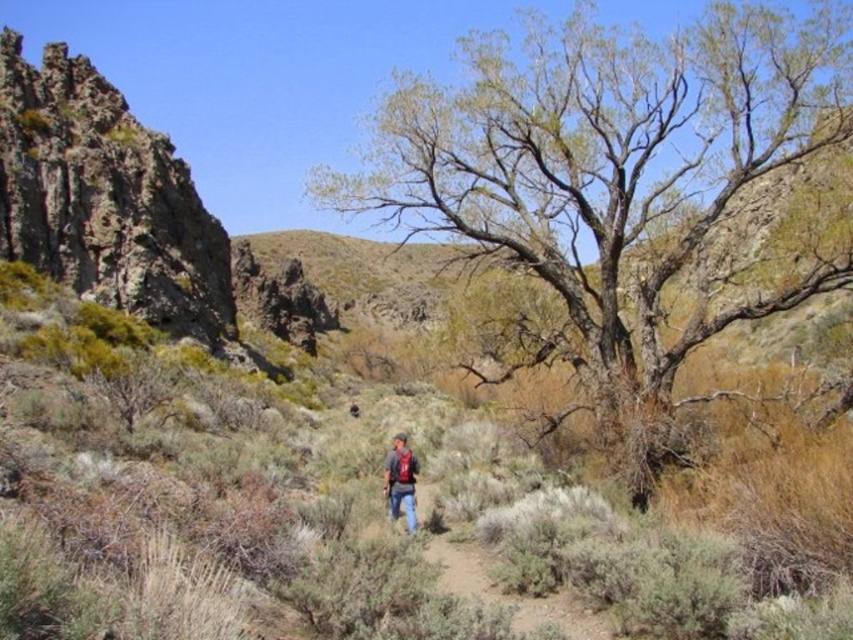
Is brown dry grass at center to the left of green rough bark tree at center from the viewer's perspective?

Correct, you'll find brown dry grass at center to the left of green rough bark tree at center.

Who is more distant from viewer, [627,602] or [497,160]?

Point [497,160]

You are a GUI agent. You are given a task and a screenshot of the screen. Output one action in this format:
    pyautogui.click(x=<x>, y=<y>)
    Task: Click on the brown dry grass at center
    Image resolution: width=853 pixels, height=640 pixels.
    Given the screenshot: What is the action you would take?
    pyautogui.click(x=352, y=506)

Is brown dry grass at center shorter than rugged stone cliff at left?

Yes.

Who is higher up, brown dry grass at center or rugged stone cliff at left?

rugged stone cliff at left is above.

Is point (212, 449) positioned before point (144, 268)?

Yes, point (212, 449) is closer to viewer.

Where is `brown dry grass at center`? The height and width of the screenshot is (640, 853). brown dry grass at center is located at coordinates (352, 506).

Between point (172, 170) and point (465, 556), which one is positioned behind?

Point (172, 170)

Does rugged stone cliff at left come behind brown dirt path at center?

A: Yes, rugged stone cliff at left is further from the viewer.

Between point (113, 216) and point (532, 627), which one is positioned behind?

The point (113, 216) is behind.

Where is `rugged stone cliff at left`? Image resolution: width=853 pixels, height=640 pixels. rugged stone cliff at left is located at coordinates (105, 198).